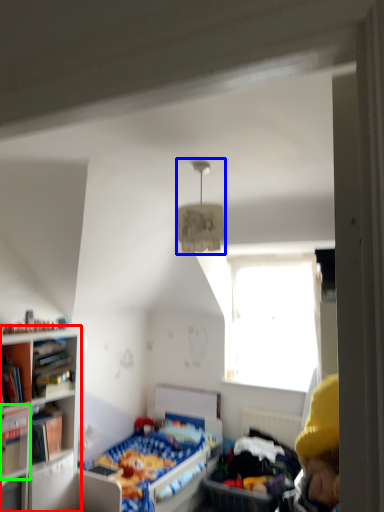
Question: Estimate the real-world distances between objects in this image. Which object is farther from bookcase (highlighted by a red box), light fixture (highlighted by a blue box) or book (highlighted by a green box)?

Choices:
 (A) light fixture
 (B) book

Answer: (A)